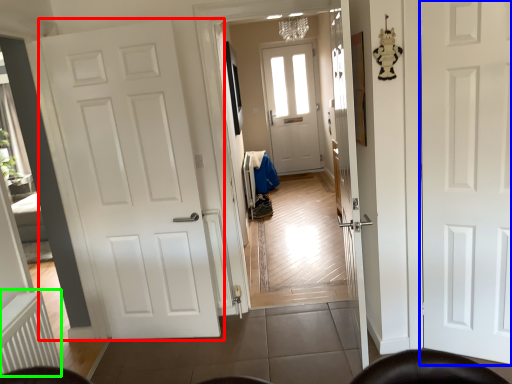
Question: Which object is the closest to the door (highlighted by a red box)? Choose among these: door (highlighted by a blue box) or radiator (highlighted by a green box).

Choices:
 (A) door
 (B) radiator

Answer: (B)